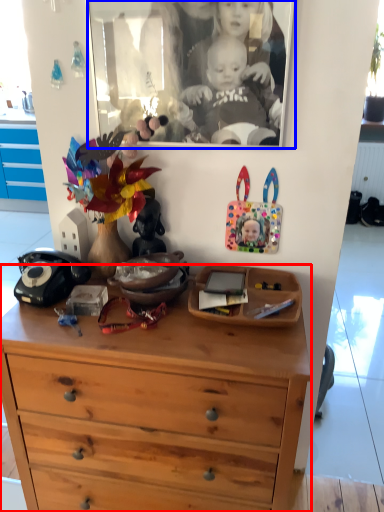
Question: Which object appears closest to the camera in this image, chest of drawers (highlighted by a red box) or picture frame (highlighted by a blue box)?

Choices:
 (A) chest of drawers
 (B) picture frame

Answer: (A)